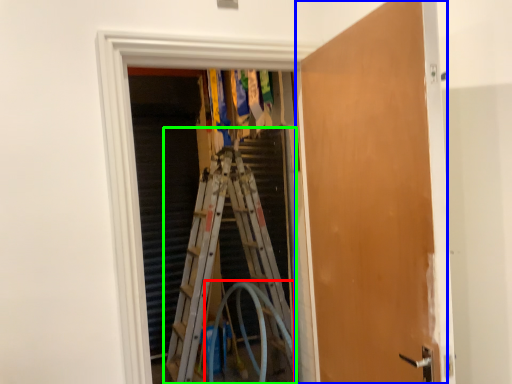
Question: Based on their relative distances, which object is nearer to garden hose (highlighted by a red box)? Choose from door (highlighted by a blue box) and ladder (highlighted by a green box).

Choices:
 (A) door
 (B) ladder

Answer: (B)